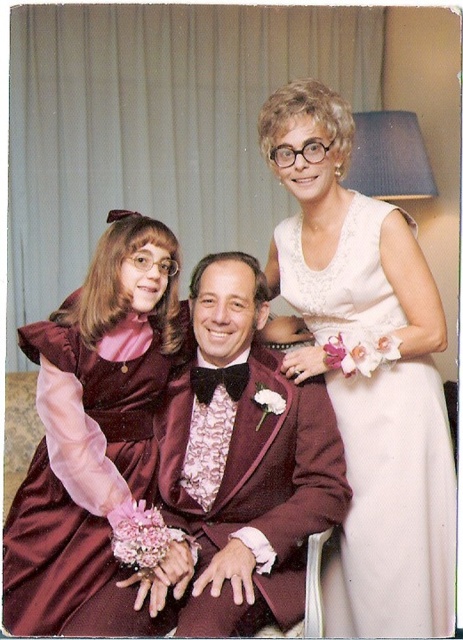
Does white satin dress at upper right have a lesser width compared to velvet burgundy dress at left?

In fact, white satin dress at upper right might be wider than velvet burgundy dress at left.

Who is lower down, white satin dress at upper right or velvet burgundy dress at left?

velvet burgundy dress at left is lower down.

Describe the element at coordinates (363, 376) in the screenshot. I see `white satin dress at upper right` at that location.

The height and width of the screenshot is (640, 463). Identify the location of white satin dress at upper right. (363, 376).